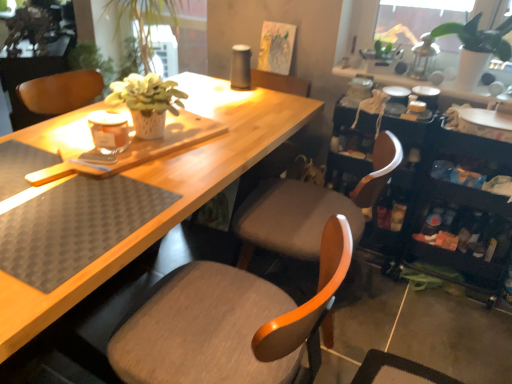
The height and width of the screenshot is (384, 512). Identify the location of white matte plant pot at upper right. (476, 47).

The image size is (512, 384). Describe the element at coordinates (228, 323) in the screenshot. I see `matte gray chair at center, marked as the first chair in a front-to-back arrangement` at that location.

Identify the location of matte gray chair at center, marked as the first chair in a front-to-back arrangement. This screenshot has width=512, height=384. (228, 323).

At what (x,y) coordinates should I click in order to perform the action: click on black rubber placemat at lower left. Please return your answer as a coordinate pair (x, y). The height and width of the screenshot is (384, 512). Looking at the image, I should click on (74, 226).

Locate an element on the screen. The image size is (512, 384). white matte plant pot at upper right is located at coordinates (476, 47).

Does matte gray chair at center, which is the first chair in back-to-front order, appear on the right side of matte gray chair at center, marked as the first chair in a front-to-back arrangement?

Yes, matte gray chair at center, which is the first chair in back-to-front order, is to the right of matte gray chair at center, marked as the first chair in a front-to-back arrangement.

Could you tell me if matte gray chair at center, the 2th chair from the front, is turned towards matte gray chair at center, placed as the 2th chair when sorted from back to front?

No, matte gray chair at center, the 2th chair from the front, is not oriented towards matte gray chair at center, placed as the 2th chair when sorted from back to front.

Identify the location of chair above the matte gray chair at center, marked as the first chair in a front-to-back arrangement (from a real-world perspective). (309, 208).

Considering the relative sizes of matte gray chair at center, the 2th chair from the front, and matte gray chair at center, marked as the first chair in a front-to-back arrangement, in the image provided, is matte gray chair at center, the 2th chair from the front, shorter than matte gray chair at center, marked as the first chair in a front-to-back arrangement,?

No, matte gray chair at center, the 2th chair from the front, is not shorter than matte gray chair at center, marked as the first chair in a front-to-back arrangement.

Could you tell me if black rubber placemat at lower left is turned towards matte gray chair at center, the 2th chair from the front?

No, black rubber placemat at lower left is not turned towards matte gray chair at center, the 2th chair from the front.

Which object is closer to the camera, black rubber placemat at lower left or matte gray chair at center, which is the first chair in back-to-front order?

black rubber placemat at lower left is closer to the camera.

From the picture: Can matte gray chair at center, the 2th chair from the front, be found inside black rubber placemat at lower left?

No.

Would you say black rubber placemat at lower left is to the left or to the right of matte gray chair at center, the 2th chair from the front, in the picture?

black rubber placemat at lower left is positioned on matte gray chair at center, the 2th chair from the front,'s left side.

Is the depth of white matte plant pot at upper right greater than that of black rubber placemat at lower left?

Yes, it is behind black rubber placemat at lower left.

From the picture: Is white matte plant pot at upper right next to black rubber placemat at lower left and touching it?

No, white matte plant pot at upper right is not in contact with black rubber placemat at lower left.

Between white matte plant pot at upper right and black rubber placemat at lower left, which one has larger width?

With larger width is black rubber placemat at lower left.

Choose the correct answer: Is white matte plant pot at upper right inside black rubber placemat at lower left or outside it?

white matte plant pot at upper right is not inside black rubber placemat at lower left, it's outside.

Does black rubber placemat at lower left turn towards white matte plant pot at upper right?

No, black rubber placemat at lower left is not oriented towards white matte plant pot at upper right.

Looking at their sizes, would you say black rubber placemat at lower left is wider or thinner than white matte plant pot at upper right?

black rubber placemat at lower left is wider than white matte plant pot at upper right.

Is black rubber placemat at lower left shorter than white matte plant pot at upper right?

Yes, black rubber placemat at lower left is shorter than white matte plant pot at upper right.

Considering the points (54, 203) and (499, 35), which point is in front, point (54, 203) or point (499, 35)?

Positioned in front is point (54, 203).

Which object is wider, black rubber placemat at lower left or matte gray chair at center, placed as the 2th chair when sorted from back to front?

With larger width is matte gray chair at center, placed as the 2th chair when sorted from back to front.

From the image's perspective, who appears lower, black rubber placemat at lower left or matte gray chair at center, marked as the first chair in a front-to-back arrangement?

matte gray chair at center, marked as the first chair in a front-to-back arrangement, is shown below in the image.

Is black rubber placemat at lower left facing towards matte gray chair at center, marked as the first chair in a front-to-back arrangement?

No, black rubber placemat at lower left is not oriented towards matte gray chair at center, marked as the first chair in a front-to-back arrangement.

From their relative heights in the image, would you say black rubber placemat at lower left is taller or shorter than matte gray chair at center, marked as the first chair in a front-to-back arrangement?

In the image, black rubber placemat at lower left appears to be shorter than matte gray chair at center, marked as the first chair in a front-to-back arrangement.

Is the position of matte gray chair at center, marked as the first chair in a front-to-back arrangement, less distant than that of white matte plant pot at upper right?

That is True.

Is the surface of matte gray chair at center, marked as the first chair in a front-to-back arrangement, in direct contact with white matte plant pot at upper right?

No, matte gray chair at center, marked as the first chair in a front-to-back arrangement, is not with white matte plant pot at upper right.

Does matte gray chair at center, placed as the 2th chair when sorted from back to front, appear on the right side of white matte plant pot at upper right?

Incorrect, matte gray chair at center, placed as the 2th chair when sorted from back to front, is not on the right side of white matte plant pot at upper right.

Considering the relative sizes of white matte plant pot at upper right and matte gray chair at center, placed as the 2th chair when sorted from back to front, in the image provided, is white matte plant pot at upper right thinner than matte gray chair at center, placed as the 2th chair when sorted from back to front,?

Yes, white matte plant pot at upper right is thinner than matte gray chair at center, placed as the 2th chair when sorted from back to front.

Which object is positioned more to the left, white matte plant pot at upper right or matte gray chair at center, marked as the first chair in a front-to-back arrangement?

matte gray chair at center, marked as the first chair in a front-to-back arrangement.

Is white matte plant pot at upper right positioned far away from matte gray chair at center, placed as the 2th chair when sorted from back to front?

Yes, white matte plant pot at upper right and matte gray chair at center, placed as the 2th chair when sorted from back to front, are located far from each other.

The width and height of the screenshot is (512, 384). I want to click on chair lying above the matte gray chair at center, marked as the first chair in a front-to-back arrangement (from the image's perspective), so click(309, 208).

From the image's perspective, count 1st chairs downward from the black rubber placemat at lower left and point to it. Please provide its 2D coordinates.

[(309, 208)]

Based on their spatial positions, is white matte plant pot at upper right or black rubber placemat at lower left further from matte gray chair at center, marked as the first chair in a front-to-back arrangement?

The object further to matte gray chair at center, marked as the first chair in a front-to-back arrangement, is white matte plant pot at upper right.

When comparing their distances from matte gray chair at center, which is the first chair in back-to-front order, does black rubber placemat at lower left or white matte plant pot at upper right seem closer?

black rubber placemat at lower left.

Considering their positions, is matte gray chair at center, placed as the 2th chair when sorted from back to front, positioned closer to white matte plant pot at upper right than black rubber placemat at lower left?

matte gray chair at center, placed as the 2th chair when sorted from back to front, is positioned closer to the anchor white matte plant pot at upper right.

Estimate the real-world distances between objects in this image. Which object is closer to black rubber placemat at lower left, white matte plant pot at upper right or matte gray chair at center, marked as the first chair in a front-to-back arrangement?

The object closer to black rubber placemat at lower left is matte gray chair at center, marked as the first chair in a front-to-back arrangement.

Looking at this image, from the image, which object appears to be nearer to matte gray chair at center, marked as the first chair in a front-to-back arrangement, matte gray chair at center, which is the first chair in back-to-front order, or white matte plant pot at upper right?

Based on the image, matte gray chair at center, which is the first chair in back-to-front order, appears to be nearer to matte gray chair at center, marked as the first chair in a front-to-back arrangement.

Looking at the image, which one is located closer to matte gray chair at center, the 2th chair from the front, white matte plant pot at upper right or matte gray chair at center, marked as the first chair in a front-to-back arrangement?

matte gray chair at center, marked as the first chair in a front-to-back arrangement.

Which object lies further to the anchor point black rubber placemat at lower left, matte gray chair at center, the 2th chair from the front, or matte gray chair at center, placed as the 2th chair when sorted from back to front?

Based on the image, matte gray chair at center, the 2th chair from the front, appears to be further to black rubber placemat at lower left.

Based on their spatial positions, is black rubber placemat at lower left or matte gray chair at center, placed as the 2th chair when sorted from back to front, closer to matte gray chair at center, which is the first chair in back-to-front order?

Based on the image, matte gray chair at center, placed as the 2th chair when sorted from back to front, appears to be nearer to matte gray chair at center, which is the first chair in back-to-front order.

I want to click on chair between black rubber placemat at lower left and matte gray chair at center, the 2th chair from the front, in the horizontal direction, so click(228, 323).

Locate an element on the screen. chair between white matte plant pot at upper right and matte gray chair at center, marked as the first chair in a front-to-back arrangement, from top to bottom is located at coordinates (309, 208).